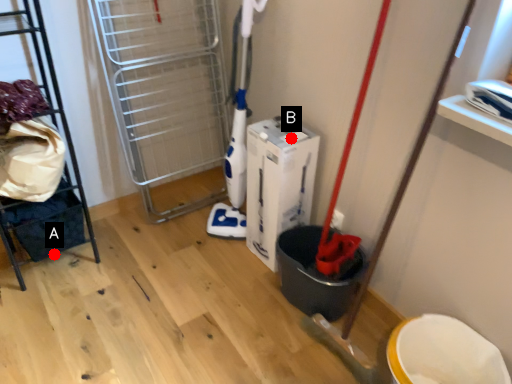
Question: Two points are circled on the image, labeled by A and B beside each circle. Which point is closer to the camera?

Choices:
 (A) A is closer
 (B) B is closer

Answer: (B)